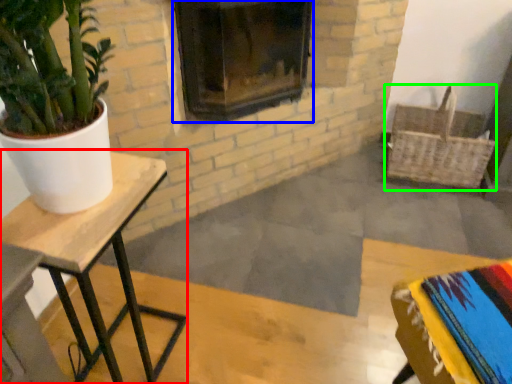
Question: Which is nearer to the table (highlighted by a red box)? fireplace (highlighted by a blue box) or basket (highlighted by a green box).

Choices:
 (A) fireplace
 (B) basket

Answer: (A)